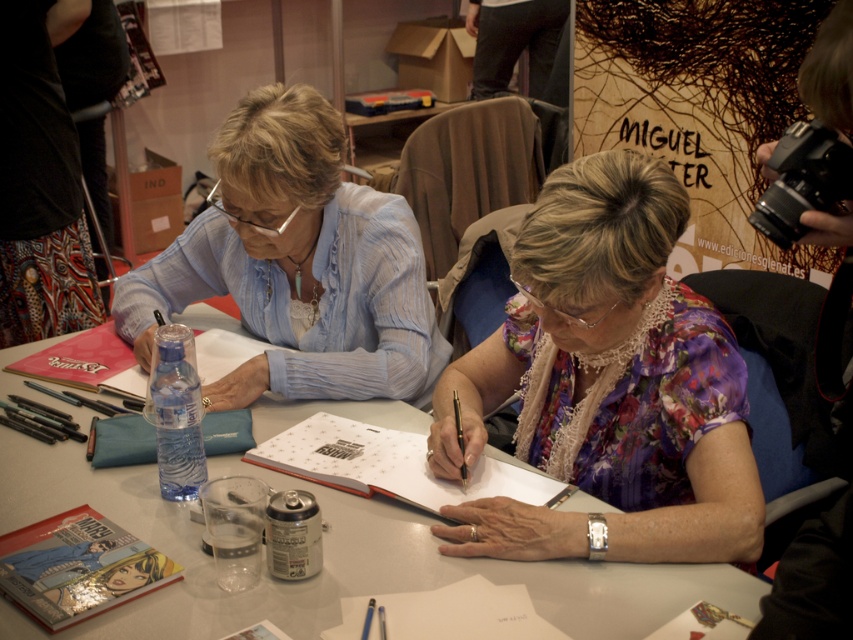
What is the location of the white paper at center in the image?

The white paper at center is located at point (341,449).

You are organizing a photo shoot and need to ensure that the floral silk blouse at center and the matte blue shirt at center are visible in the frame. Based on their positions, which one is more likely to be obscured by the other?

The floral silk blouse at center is taller than the matte blue shirt at center, so it is more likely to obscure the matte blue shirt at center in the frame.

You are a photographer taking a picture of the two women at the signing event. You notice two points of light reflecting off the table surface. The first point is at coordinate point[595,227] and the second at point[339,186]. Which point should you adjust your camera focus to capture more clearly?

Point[595,227] is closer to the camera than point[339,186], so you should adjust your camera focus to capture point[595,227] more clearly since it is nearer.